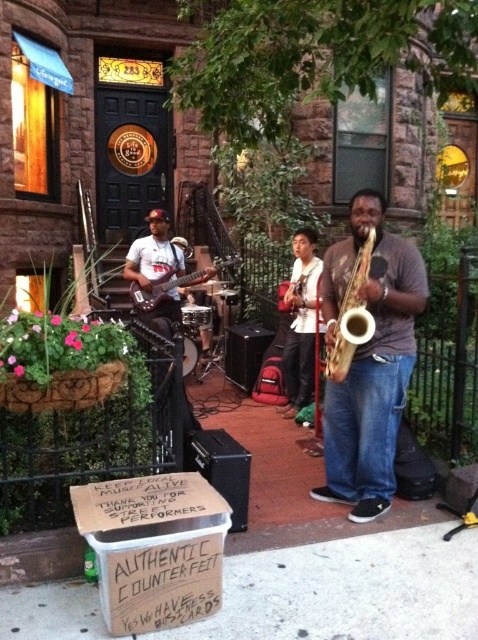
How far apart are white concrete pavement at lower center and matte black guitar at center?

white concrete pavement at lower center and matte black guitar at center are 3.45 meters apart from each other.

Find the location of a particular element. The width and height of the screenshot is (478, 640). white concrete pavement at lower center is located at coordinates (348, 589).

Who is more forward, (x=293, y=586) or (x=131, y=296)?

Point (x=293, y=586) is in front.

Can you confirm if white concrete pavement at lower center is positioned to the right of shiny black electric guitar at center?

Yes, white concrete pavement at lower center is to the right of shiny black electric guitar at center.

Where is `white concrete pavement at lower center`? white concrete pavement at lower center is located at coordinates (348, 589).

Identify the location of white concrete pavement at lower center. (348, 589).

Can you confirm if matte black guitar at center is taller than shiny gold saxophone at center?

Yes.

Which is behind, point (161, 252) or point (339, 323)?

Positioned behind is point (161, 252).

Does point (210, 266) come farther from viewer compared to point (347, 330)?

Yes, it is.

At what (x,y) coordinates should I click in order to perform the action: click on matte black guitar at center. Please return your answer as a coordinate pair (x, y). This screenshot has height=640, width=478. Looking at the image, I should click on (153, 253).